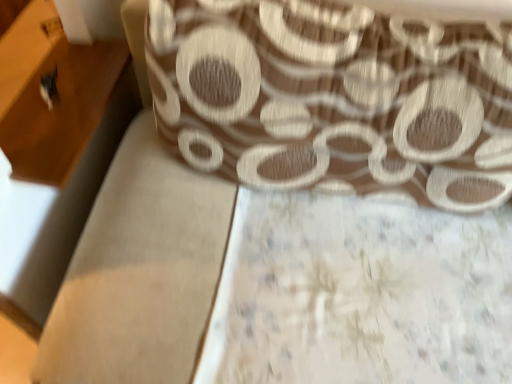
Find the location of a particular element. The image size is (512, 384). free location above wooden drawer at left (from a real-world perspective) is located at coordinates (77, 108).